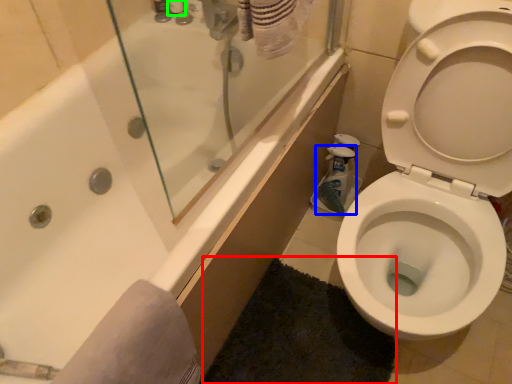
Question: Based on their relative distances, which object is farther from bath mat (highlighted by a red box)? Choose from cleaning product (highlighted by a blue box) and toiletry (highlighted by a green box).

Choices:
 (A) cleaning product
 (B) toiletry

Answer: (B)